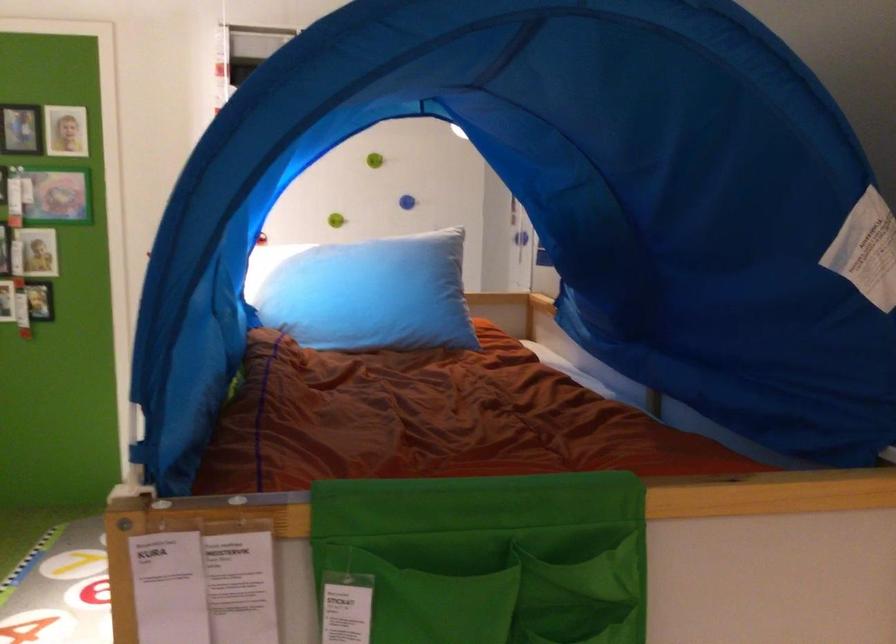
Identify the location of blue wall knob. Image resolution: width=896 pixels, height=644 pixels. (407, 202).